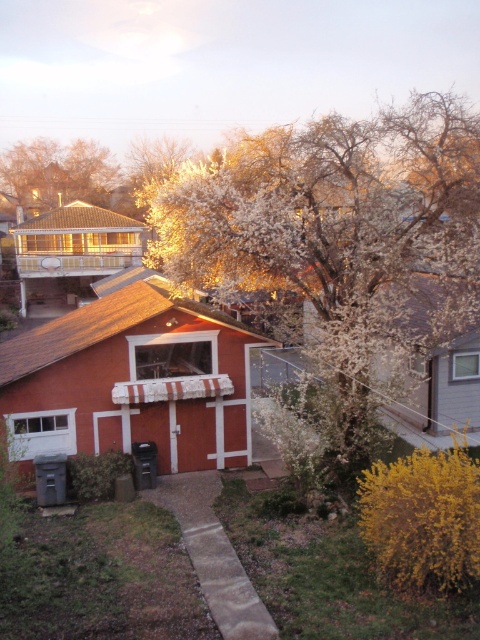
You are standing on the concrete pathway leading to the red brick house. You notice two white blossoms in the scene. Which one is closer to you, the white blossoming tree at upper center or the fluffy white blossoms at upper left?

The white blossoming tree at upper center is closer to the viewer than the fluffy white blossoms at upper left.

You are standing at the entrance of the house and want to go to the trash bins located near the curb. Which point, point (384, 364) or point (69, 186), is closer to your current position?

Point (384, 364) is in front of point (69, 186), so it is closer to your current position at the entrance of the house.

You are standing in front of the house and notice the white blossoming tree at upper center and the matte red wood shed at center. Which object is taller?

The white blossoming tree at upper center is taller than the matte red wood shed at center.